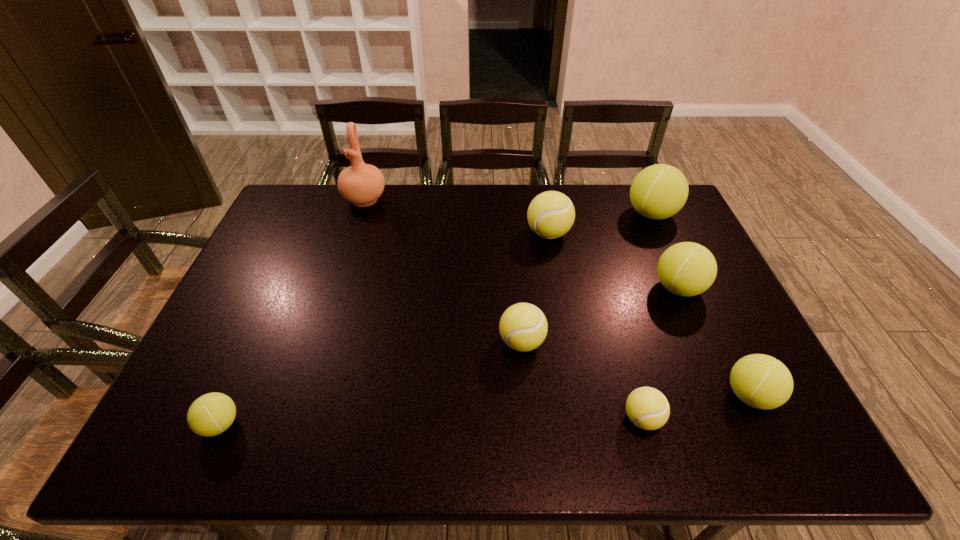
The width and height of the screenshot is (960, 540). In order to click on pottery in this screenshot , I will do `click(362, 184)`.

Locate an element on the screen. The height and width of the screenshot is (540, 960). the seventh object from right to left is located at coordinates (362, 184).

Locate an element on the screen. This screenshot has height=540, width=960. the tallest tennis ball is located at coordinates (659, 191).

You are a GUI agent. You are given a task and a screenshot of the screen. Output one action in this format:
    pyautogui.click(x=<x>, y=<y>)
    Task: Click on the farthest green tennis ball
    The height and width of the screenshot is (540, 960).
    Given the screenshot: What is the action you would take?
    pyautogui.click(x=659, y=191)

Where is `the farthest yellow tennis ball`? Image resolution: width=960 pixels, height=540 pixels. the farthest yellow tennis ball is located at coordinates (551, 214).

This screenshot has width=960, height=540. Identify the location of the third nearest green tennis ball. (686, 269).

Locate an element on the screen. the second biggest green tennis ball is located at coordinates (686, 269).

Image resolution: width=960 pixels, height=540 pixels. In order to click on the second nearest yellow tennis ball in this screenshot , I will do coord(523,327).

Locate an element on the screen. The image size is (960, 540). the fourth farthest tennis ball is located at coordinates (523, 327).

Locate an element on the screen. This screenshot has height=540, width=960. the second smallest green tennis ball is located at coordinates (760, 381).